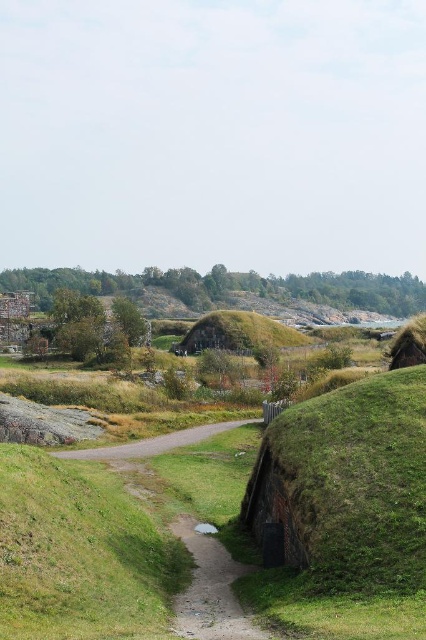
Looking at this image, does dirt/gravel path at center appear under gravel road at center?

Indeed, dirt/gravel path at center is positioned under gravel road at center.

Which is more to the right, dirt/gravel path at center or gravel road at center?

Positioned to the right is dirt/gravel path at center.

The image size is (426, 640). I want to click on dirt/gravel path at center, so click(x=210, y=589).

Is dirt/gravel path at center positioned behind green grassy mound at center?

No.

Describe the element at coordinates (210, 589) in the screenshot. I see `dirt/gravel path at center` at that location.

At what (x,y) coordinates should I click in order to perform the action: click on dirt/gravel path at center. Please return your answer as a coordinate pair (x, y). Looking at the image, I should click on (210, 589).

Is green grassy mound at center bigger than gravel road at center?

Correct, green grassy mound at center is larger in size than gravel road at center.

Which of these two, green grassy mound at center or gravel road at center, stands taller?

green grassy mound at center is taller.

Is point (224, 339) more distant than point (164, 436)?

Yes, point (224, 339) is farther from viewer.

This screenshot has height=640, width=426. What are the coordinates of `green grassy mound at center` in the screenshot? It's located at (238, 332).